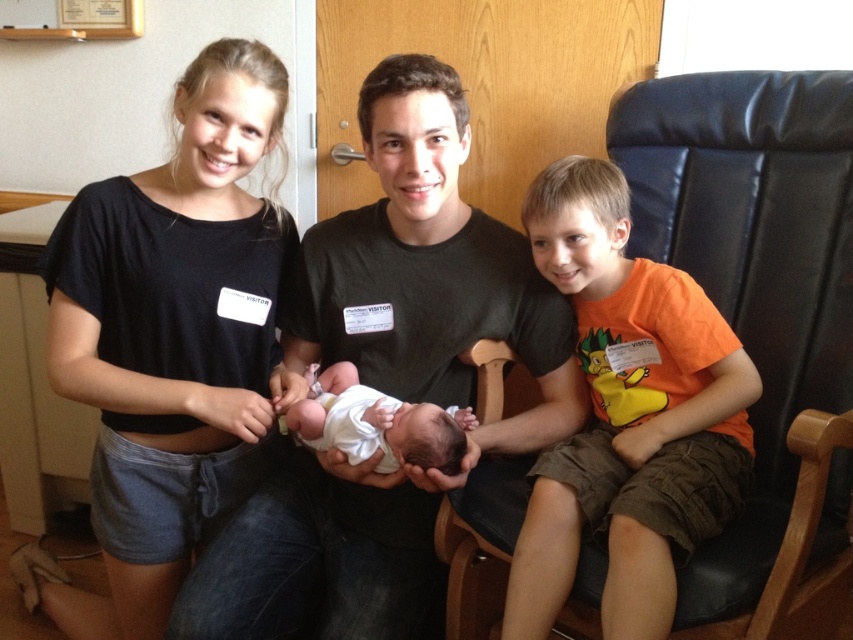
Question: Which point is farther to the camera?

Choices:
 (A) (355, 403)
 (B) (526, 451)
 (C) (158, 353)

Answer: (B)

Question: Which point is farther from the camera taking this photo?

Choices:
 (A) (270, 420)
 (B) (415, 420)

Answer: (A)

Question: Is black cotton shirt at upper left to the left of white soft newborn at center from the viewer's perspective?

Choices:
 (A) no
 (B) yes

Answer: (B)

Question: Does matte black shirt at center appear on the left side of black cotton shirt at upper left?

Choices:
 (A) yes
 (B) no

Answer: (B)

Question: Which of the following is the closest to the observer?

Choices:
 (A) matte black shirt at center
 (B) black cotton shirt at upper left
 (C) white soft newborn at center

Answer: (A)

Question: Considering the relative positions of matte black shirt at center and orange cotton shirt at right in the image provided, where is matte black shirt at center located with respect to orange cotton shirt at right?

Choices:
 (A) below
 (B) above

Answer: (B)